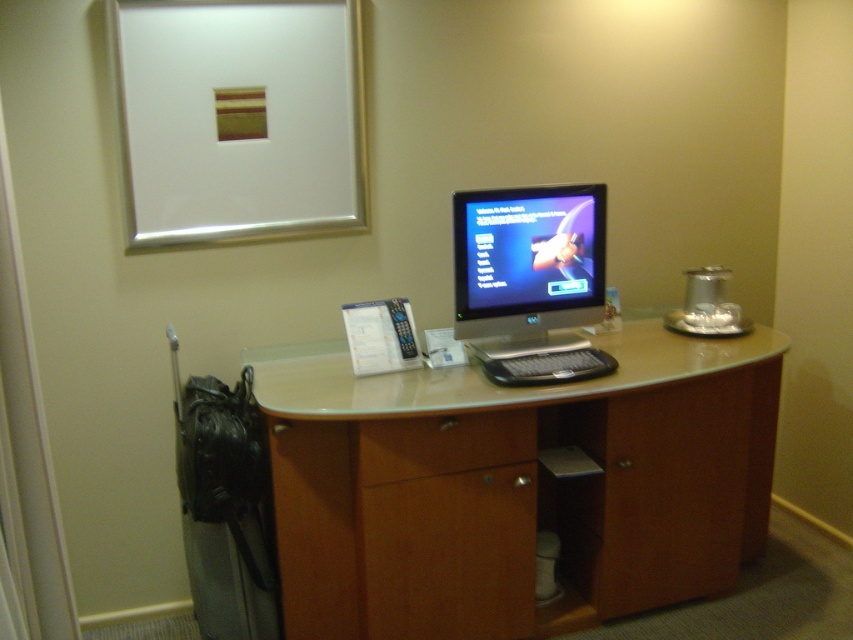
Question: Which object is positioned farthest from the silver metallic picture frame at upper center?

Choices:
 (A) wooden computer desk at center
 (B) satin silver monitor at center
 (C) wooden drawer at center

Answer: (C)

Question: Where is wooden computer desk at center located in relation to satin silver monitor at center in the image?

Choices:
 (A) right
 (B) left

Answer: (A)

Question: Estimate the real-world distances between objects in this image. Which object is farther from the silver metallic picture frame at upper center?

Choices:
 (A) wooden computer desk at center
 (B) satin silver monitor at center
 (C) wooden drawer at center

Answer: (C)

Question: Is wooden computer desk at center thinner than silver metallic picture frame at upper center?

Choices:
 (A) yes
 (B) no

Answer: (B)

Question: Is satin silver monitor at center to the left of wooden drawer at center from the viewer's perspective?

Choices:
 (A) no
 (B) yes

Answer: (A)

Question: Which point is farther to the camera?

Choices:
 (A) (340, 195)
 (B) (425, 456)

Answer: (A)